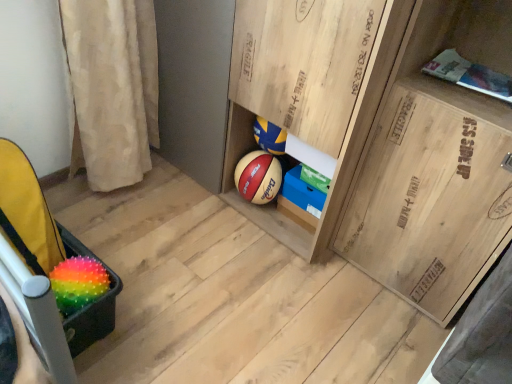
Question: Which direction should I rotate to look at wooden cabinet at center, placed as the third cabinetry when sorted from right to left, — up or down?

Choices:
 (A) up
 (B) down

Answer: (A)

Question: Is wooden crate at right, which appears as the first cabinetry when viewed from the right, to the right of wooden cabinet at center, placed as the third cabinetry when sorted from right to left, from the viewer's perspective?

Choices:
 (A) no
 (B) yes

Answer: (B)

Question: Does wooden crate at right, which appears as the first cabinetry when viewed from the right, have a lesser height compared to wooden cabinet at center, placed as the third cabinetry when sorted from right to left?

Choices:
 (A) no
 (B) yes

Answer: (A)

Question: From the image's perspective, is wooden crate at right, the third cabinetry from the left, located beneath wooden cabinet at center, the 1th cabinetry viewed from the left?

Choices:
 (A) no
 (B) yes

Answer: (B)

Question: Is wooden cabinet at center, placed as the third cabinetry when sorted from right to left, located within wooden crate at right, the third cabinetry from the left?

Choices:
 (A) yes
 (B) no

Answer: (B)

Question: Considering the relative sizes of wooden crate at right, which appears as the first cabinetry when viewed from the right, and wooden cabinet at center, placed as the third cabinetry when sorted from right to left, in the image provided, is wooden crate at right, which appears as the first cabinetry when viewed from the right, smaller than wooden cabinet at center, placed as the third cabinetry when sorted from right to left,?

Choices:
 (A) yes
 (B) no

Answer: (A)

Question: Would you say wooden crate at right, which appears as the first cabinetry when viewed from the right, is outside wooden cabinet at center, placed as the third cabinetry when sorted from right to left?

Choices:
 (A) no
 (B) yes

Answer: (B)

Question: Can you confirm if blue cardboard box at center, acting as the second cabinetry starting from the left, is positioned to the left of rainbow spiky ball at lower left?

Choices:
 (A) no
 (B) yes

Answer: (A)

Question: From a real-world perspective, is blue cardboard box at center, which is the 2th cabinetry in right-to-left order, beneath rainbow spiky ball at lower left?

Choices:
 (A) no
 (B) yes

Answer: (B)

Question: From the image's perspective, is blue cardboard box at center, which is the 2th cabinetry in right-to-left order, on rainbow spiky ball at lower left?

Choices:
 (A) yes
 (B) no

Answer: (A)

Question: Can you confirm if blue cardboard box at center, which is the 2th cabinetry in right-to-left order, is bigger than rainbow spiky ball at lower left?

Choices:
 (A) yes
 (B) no

Answer: (A)

Question: Can you confirm if blue cardboard box at center, acting as the second cabinetry starting from the left, is thinner than rainbow spiky ball at lower left?

Choices:
 (A) yes
 (B) no

Answer: (A)

Question: Considering the relative sizes of blue cardboard box at center, which is the 2th cabinetry in right-to-left order, and rainbow spiky ball at lower left in the image provided, is blue cardboard box at center, which is the 2th cabinetry in right-to-left order, smaller than rainbow spiky ball at lower left?

Choices:
 (A) yes
 (B) no

Answer: (B)

Question: Is blue cardboard box at center, which is the 2th cabinetry in right-to-left order, to the right of wooden cabinet at center, the 1th cabinetry viewed from the left, from the viewer's perspective?

Choices:
 (A) no
 (B) yes

Answer: (B)